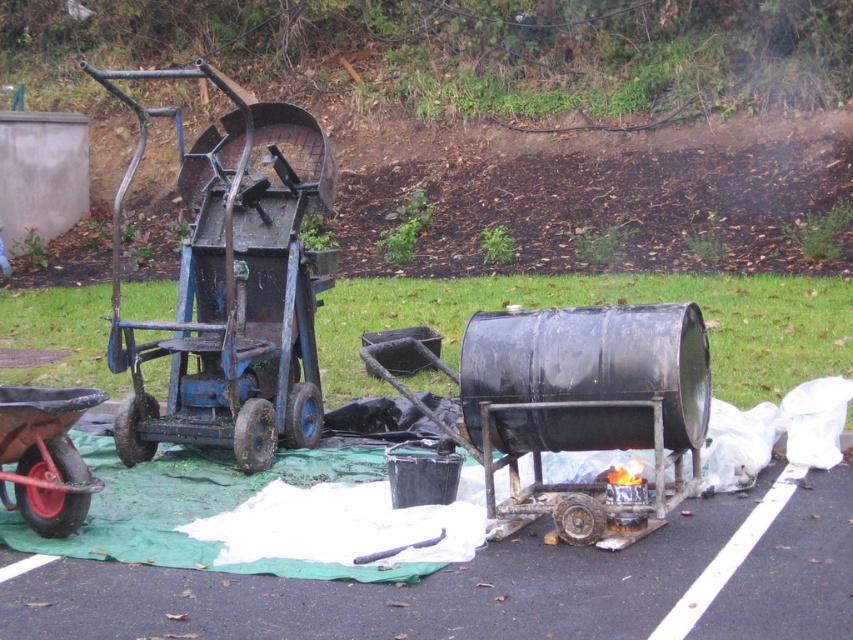
Question: Which point is closer to the camera?

Choices:
 (A) (320, 150)
 (B) (0, 444)

Answer: (B)

Question: Is rusty metal cart at center positioned at the back of rusty metal wheelbarrow at lower left?

Choices:
 (A) yes
 (B) no

Answer: (A)

Question: Can you confirm if rusty metal cart at center is positioned to the right of rusty metal wheelbarrow at lower left?

Choices:
 (A) no
 (B) yes

Answer: (A)

Question: Can you confirm if rusty metal cart at center is thinner than rusty metal wheelbarrow at lower left?

Choices:
 (A) no
 (B) yes

Answer: (A)

Question: Which object appears closest to the camera in this image?

Choices:
 (A) rusty metal wheelbarrow at lower left
 (B) rusty metal cart at center

Answer: (A)

Question: Among these points, which one is farthest from the camera?

Choices:
 (A) (283, 416)
 (B) (70, 477)

Answer: (A)